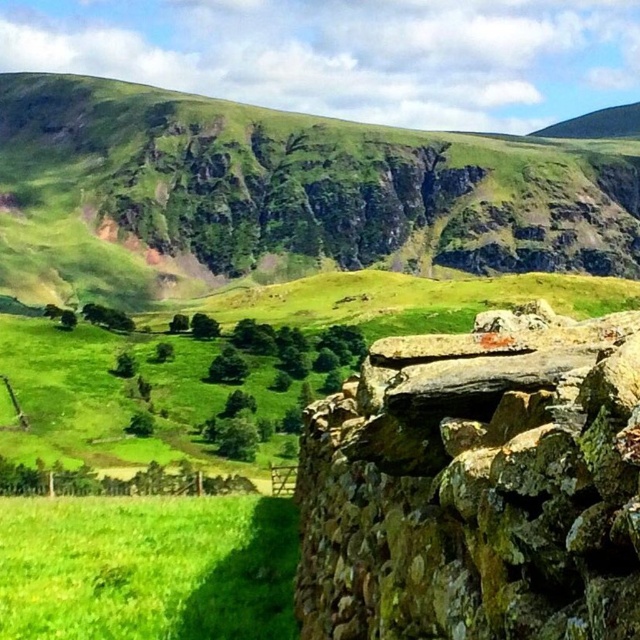
Does rusty stone cliff at right have a greater width compared to green grassy field at lower left?

No.

The image size is (640, 640). What do you see at coordinates (477, 484) in the screenshot?
I see `rusty stone cliff at right` at bounding box center [477, 484].

Where is `rusty stone cliff at right`? rusty stone cliff at right is located at coordinates (477, 484).

Is green grassy hillside at upper center behind rusty stone cliff at right?

Yes, green grassy hillside at upper center is behind rusty stone cliff at right.

Which of these two, green grassy hillside at upper center or rusty stone cliff at right, stands taller?

green grassy hillside at upper center is taller.

Is point (140, 84) in front of point (406, 435)?

No, (140, 84) is further to viewer.

Where is `green grassy hillside at upper center`? Image resolution: width=640 pixels, height=640 pixels. green grassy hillside at upper center is located at coordinates (291, 193).

Does green grassy hillside at upper center have a smaller size compared to green grassy field at lower left?

No.

Is green grassy hillside at upper center below green grassy field at lower left?

Incorrect, green grassy hillside at upper center is not positioned below green grassy field at lower left.

The height and width of the screenshot is (640, 640). In order to click on green grassy hillside at upper center in this screenshot , I will do `click(291, 193)`.

At what (x,y) coordinates should I click in order to perform the action: click on green grassy hillside at upper center. Please return your answer as a coordinate pair (x, y). Looking at the image, I should click on (291, 193).